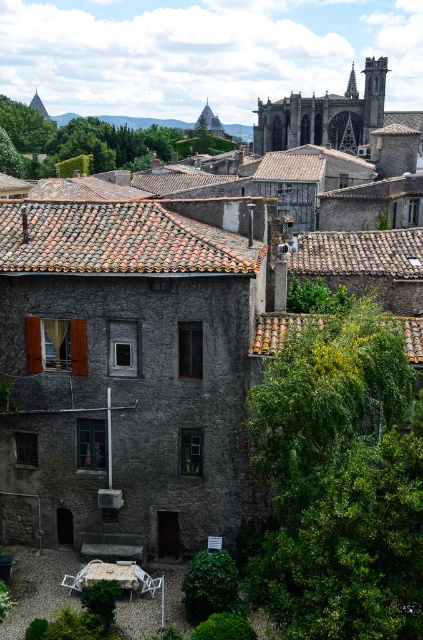
Is green leafy tree at lower right shorter than green leafy tree at upper center?

Yes.

Does green leafy tree at lower right appear on the left side of green leafy tree at upper center?

No, green leafy tree at lower right is not to the left of green leafy tree at upper center.

Which is in front, point (269, 608) or point (208, 147)?

Point (269, 608) is in front.

The image size is (423, 640). Find the location of `green leafy tree at lower right`. green leafy tree at lower right is located at coordinates (338, 483).